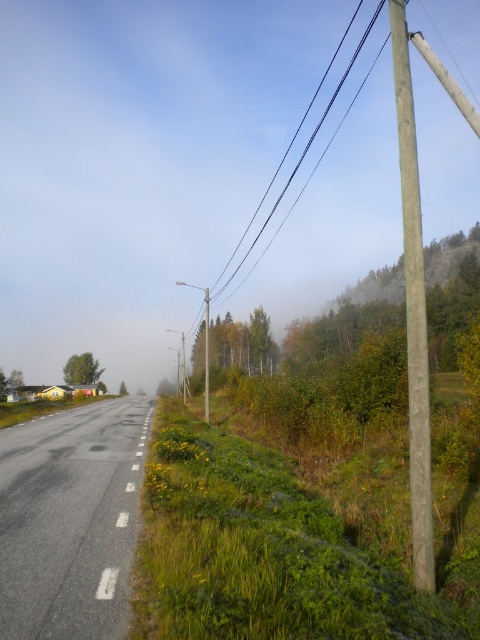
Which of these two, asphalt road at center or smooth wire at upper right, stands shorter?

asphalt road at center is shorter.

At what (x,y) coordinates should I click in order to perform the action: click on asphalt road at center. Please return your answer as a coordinate pair (x, y). This screenshot has width=480, height=640. Looking at the image, I should click on (71, 520).

Which is behind, point (58, 445) or point (352, 61)?

Point (352, 61)

Identify the location of asphalt road at center. This screenshot has height=640, width=480. (71, 520).

Is asphalt road at center below smooth gray pole at right?

Indeed, asphalt road at center is positioned under smooth gray pole at right.

Does point (7, 492) lie behind point (407, 264)?

Yes, it is behind point (407, 264).

This screenshot has width=480, height=640. Find the location of `asphalt road at center`. asphalt road at center is located at coordinates (71, 520).

Can you confirm if smooth gray pole at right is wider than smooth wire at upper right?

No, smooth gray pole at right is not wider than smooth wire at upper right.

Where is `smooth gray pole at right`? Image resolution: width=480 pixels, height=640 pixels. smooth gray pole at right is located at coordinates (414, 308).